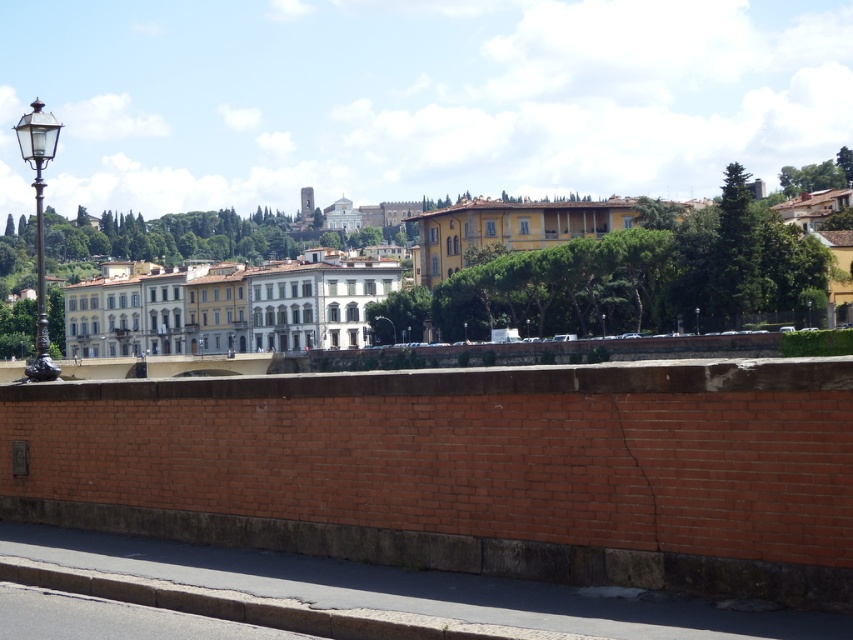
Question: Which of these objects is positioned farthest from the metallic streetlight at center?

Choices:
 (A) white glossy building at center
 (B) gray concrete curb at lower left

Answer: (B)

Question: Is gray concrete curb at lower left bigger than metallic streetlight at center?

Choices:
 (A) no
 (B) yes

Answer: (A)

Question: Considering the real-world distances, which object is closest to the polished brass streetlight at left?

Choices:
 (A) gray concrete curb at lower left
 (B) white glossy building at center
 (C) metallic streetlight at center

Answer: (B)

Question: Considering the relative positions of white glossy building at center and polished brass streetlight at left in the image provided, where is white glossy building at center located with respect to polished brass streetlight at left?

Choices:
 (A) left
 (B) right

Answer: (B)

Question: Does white glossy building at center have a larger size compared to metallic streetlight at center?

Choices:
 (A) no
 (B) yes

Answer: (B)

Question: Which is farther from the white glossy building at center?

Choices:
 (A) polished brass streetlight at left
 (B) gray concrete curb at lower left
 (C) metallic streetlight at center

Answer: (B)